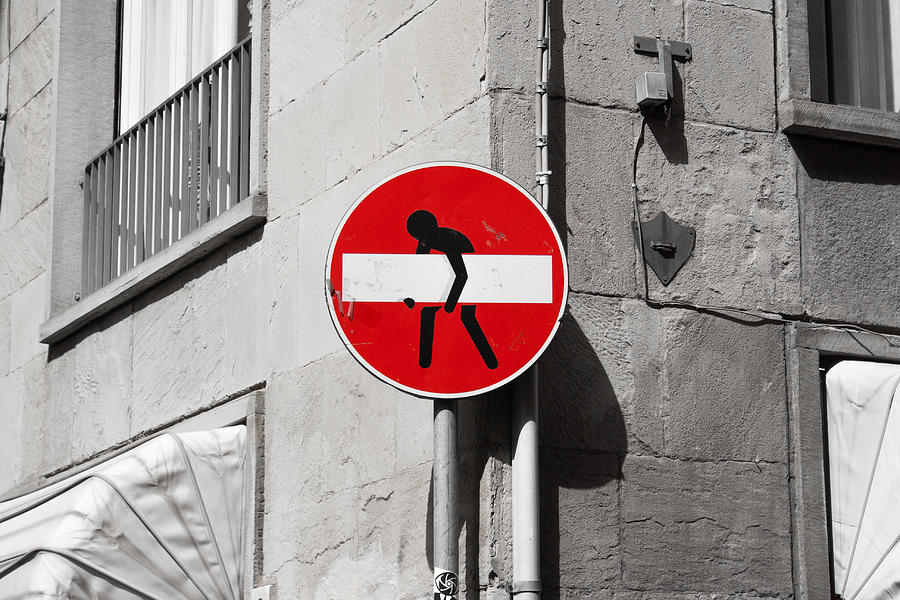
The height and width of the screenshot is (600, 900). In order to click on walls in this screenshot , I will do `click(325, 135)`, `click(716, 399)`.